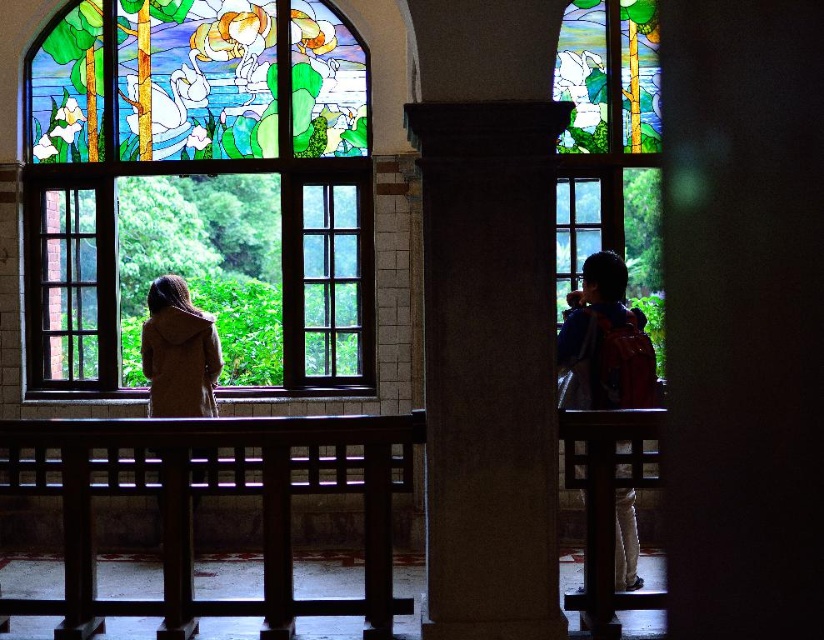
You are standing in the room with two points marked on the floor. The first point is at coordinate point (564,54) and the second is at point (600,292). If you want to walk from the first point to the second point, which direction should you move relative to the second point?

Since point (564,54) is behind point (600,292), you should move forward towards the second point from the first point.

You are standing in the room and want to take a photo of the stained glass window at right and the blue denim jacket at right. Which object should you focus on first if you want to capture both in the same frame without moving the camera?

The stained glass window at right has a lesser height compared to the blue denim jacket at right, so you should focus on the blue denim jacket at right first to ensure both fit in the frame.